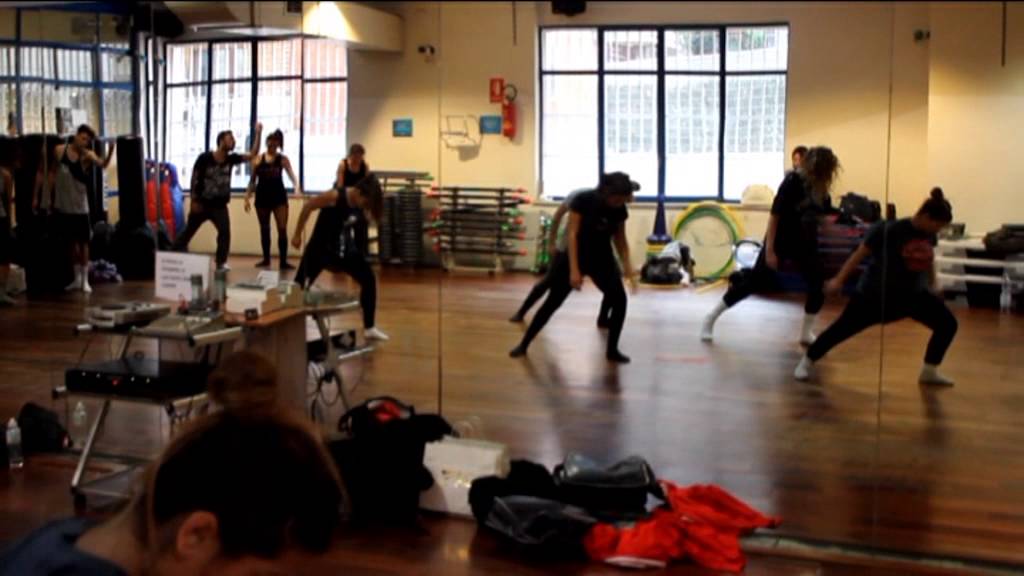
Locate an element on the screen. fire extinguisher is located at coordinates point(508,117).